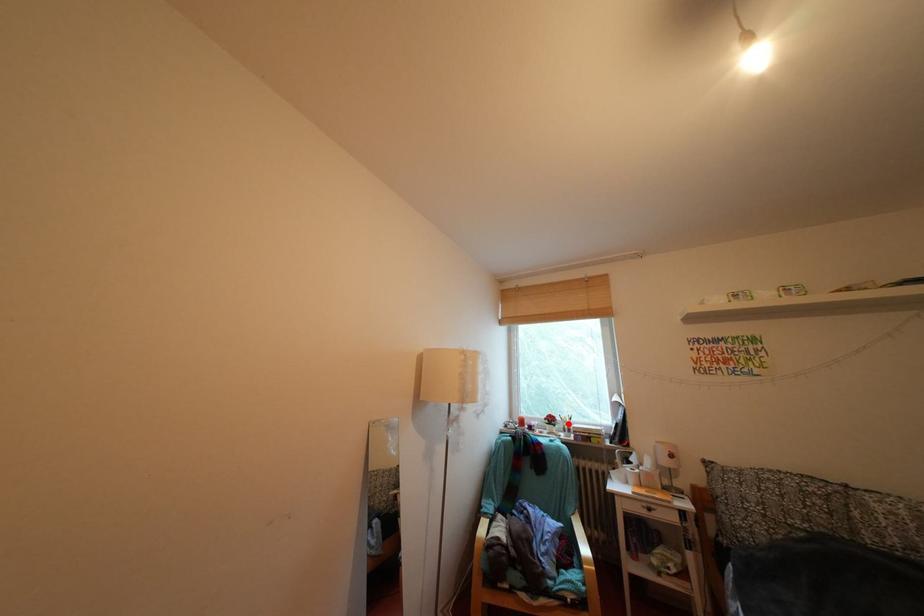
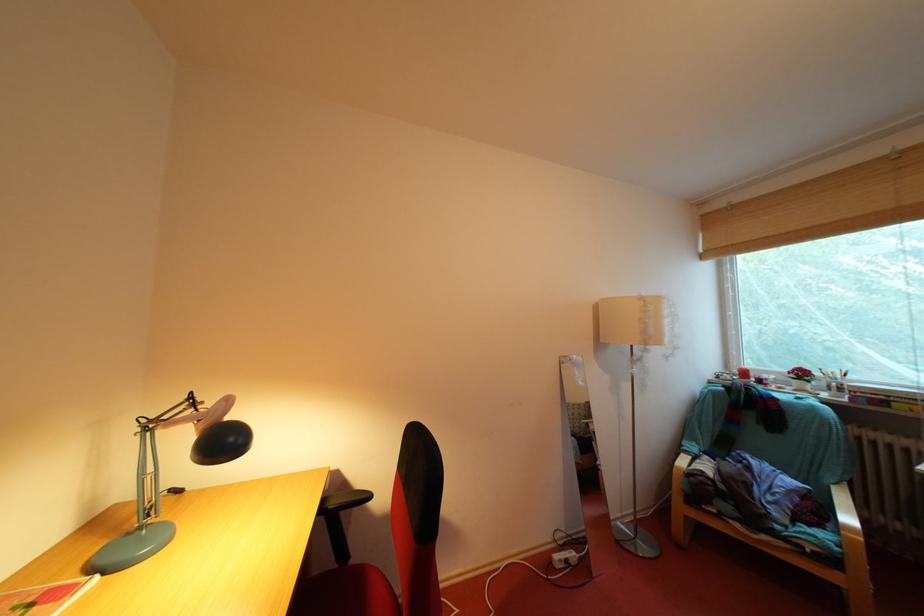
Question: A red point is marked in image1. In image2, is the corresponding 3D point closer to the camera or farther? Reply with the corresponding letter.

Choices:
 (A) The corresponding 3D point is closer.
 (B) The corresponding 3D point is farther.

Answer: (A)